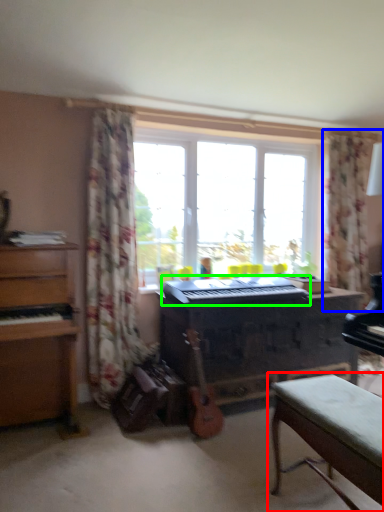
Question: Which object is positioned farthest from table (highlighted by a red box)? Select from curtain (highlighted by a blue box) and musical keyboard (highlighted by a green box).

Choices:
 (A) curtain
 (B) musical keyboard

Answer: (A)